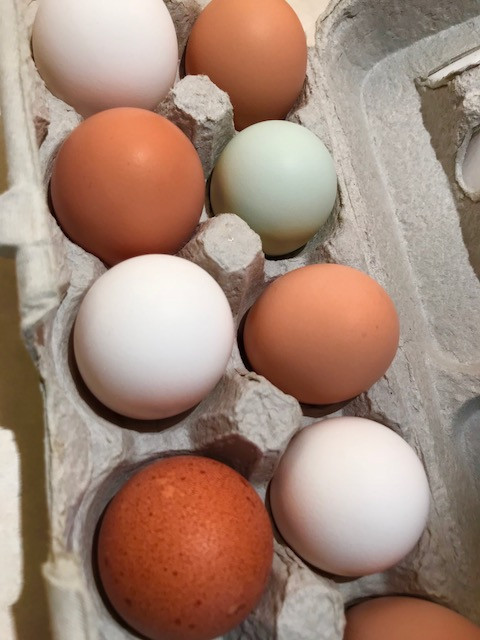
Find the location of a particular element. container divider is located at coordinates (264, 422), (307, 605), (206, 100).